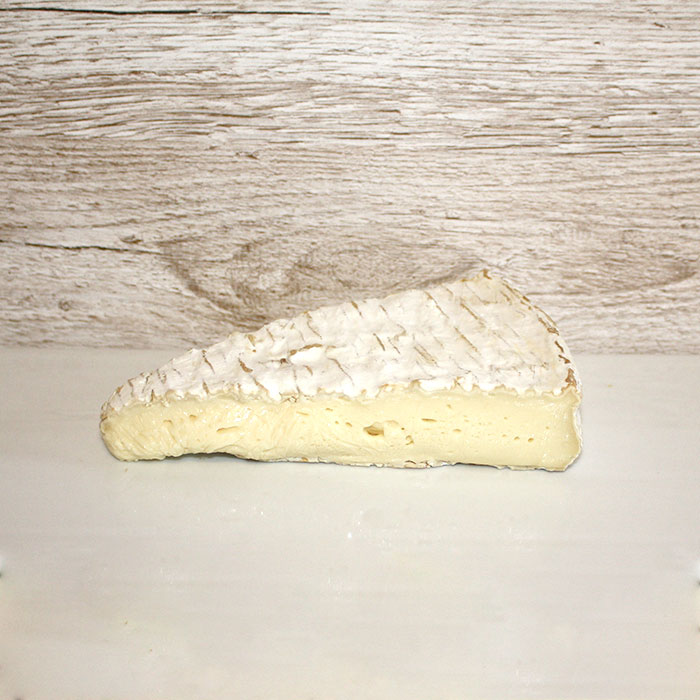
At what (x,y) coordinates should I click in order to perform the action: click on white table top. Please return your answer as a coordinate pair (x, y). Looking at the image, I should click on (414, 600).